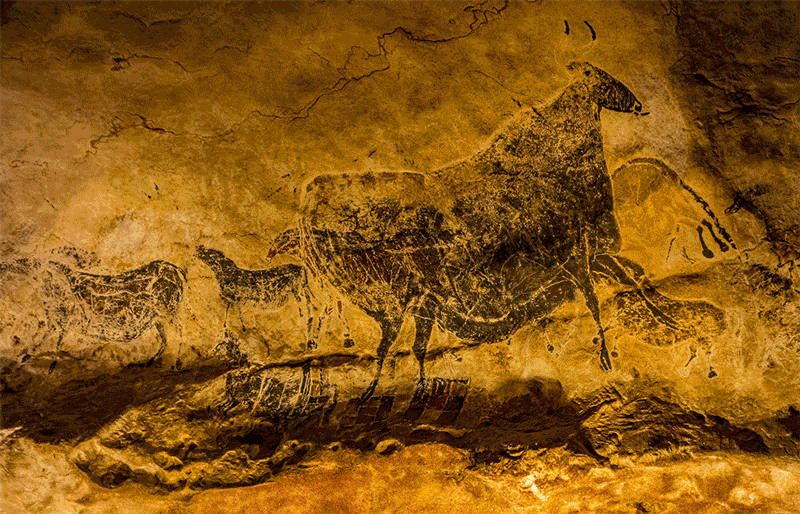
The height and width of the screenshot is (514, 800). I want to click on animal paintings, so click(x=201, y=180).